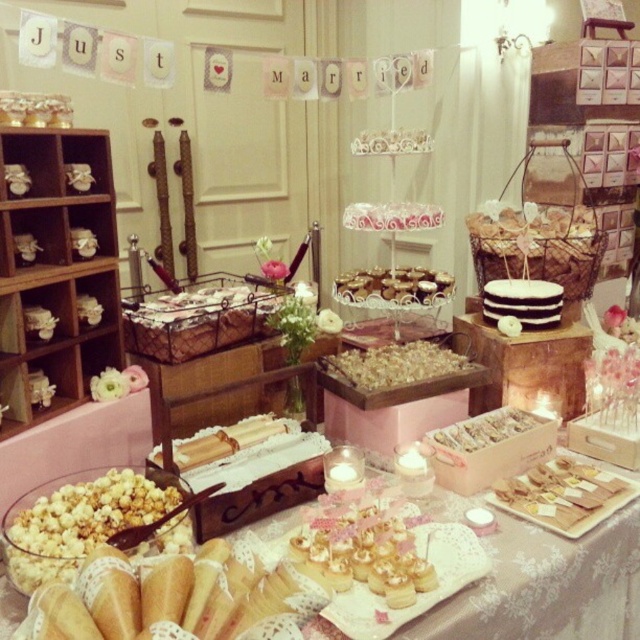
You are a guest at the wedding reception and want to grab both the caramel popcorn at center and the chocolate frosted cake at center. Can you reach both items without moving from your current position if your arm span is 1.2 meters?

The caramel popcorn at center and chocolate frosted cake at center are 1.08 meters apart. Since your arm span is 1.2 meters, which is longer than the distance between them, you can reach both items without moving.